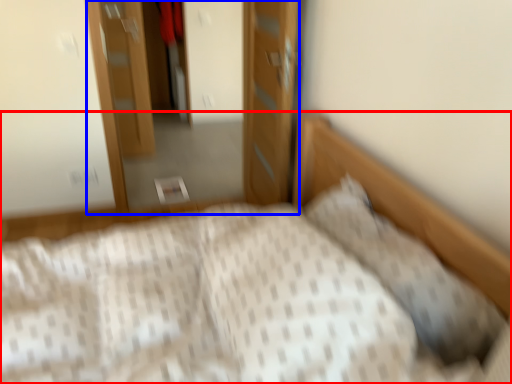
Question: Which object is closer to the camera taking this photo, bed (highlighted by a red box) or dresser (highlighted by a blue box)?

Choices:
 (A) bed
 (B) dresser

Answer: (A)